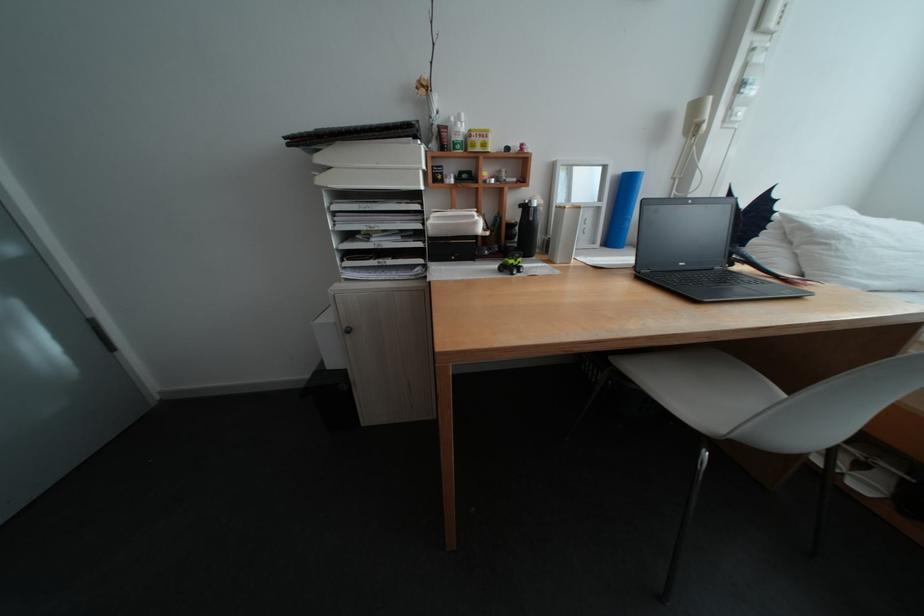
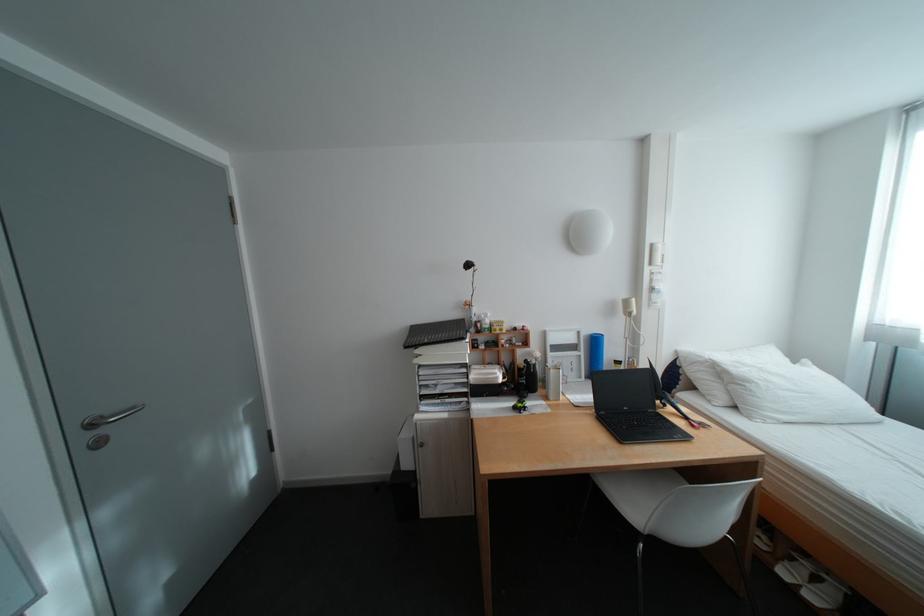
In the second image, find the point that corresponds to point (616, 205) in the first image.

(594, 354)